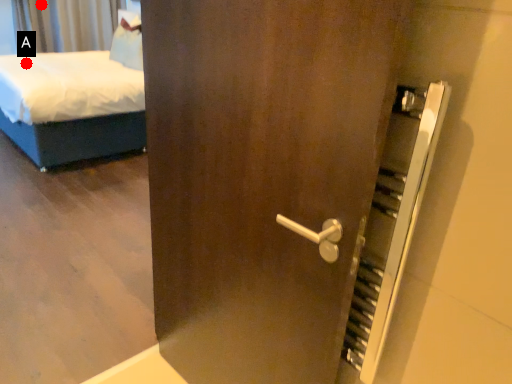
Question: Two points are circled on the image, labeled by A and B beside each circle. Which point is closer to the camera?

Choices:
 (A) A is closer
 (B) B is closer

Answer: (A)